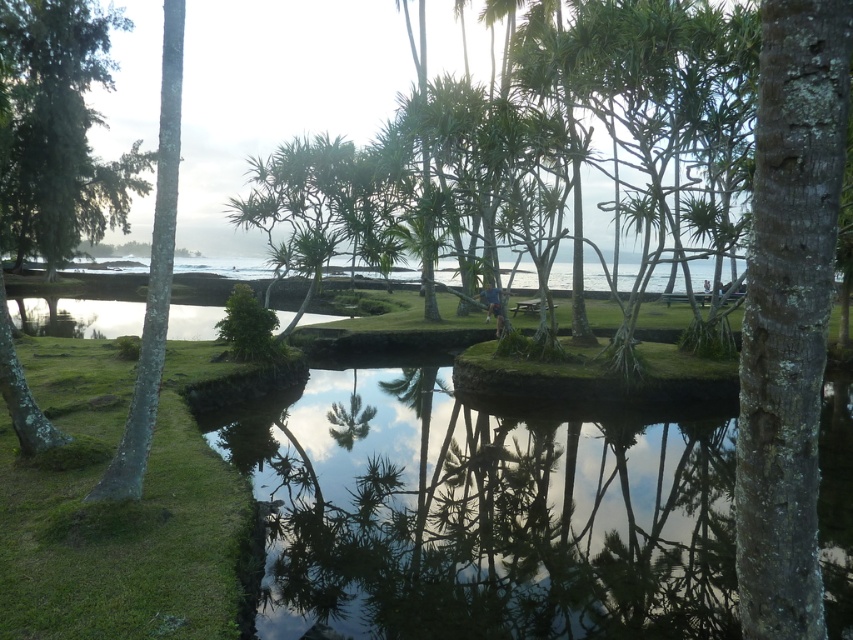
Question: Is lichen-covered bark tree at center-right to the left of green leafy tree at upper left from the viewer's perspective?

Choices:
 (A) yes
 (B) no

Answer: (B)

Question: Which of the following is the farthest from the observer?

Choices:
 (A) (62, 227)
 (B) (767, 22)

Answer: (A)

Question: Observing the image, what is the correct spatial positioning of lichen-covered bark tree at center-right in reference to green leafy tree at upper left?

Choices:
 (A) above
 (B) below

Answer: (B)

Question: From the image, what is the correct spatial relationship of lichen-covered bark tree at center-right in relation to green leafy tree at upper left?

Choices:
 (A) left
 (B) right

Answer: (B)

Question: Among these points, which one is nearest to the camera?

Choices:
 (A) (795, 272)
 (B) (45, 77)

Answer: (A)